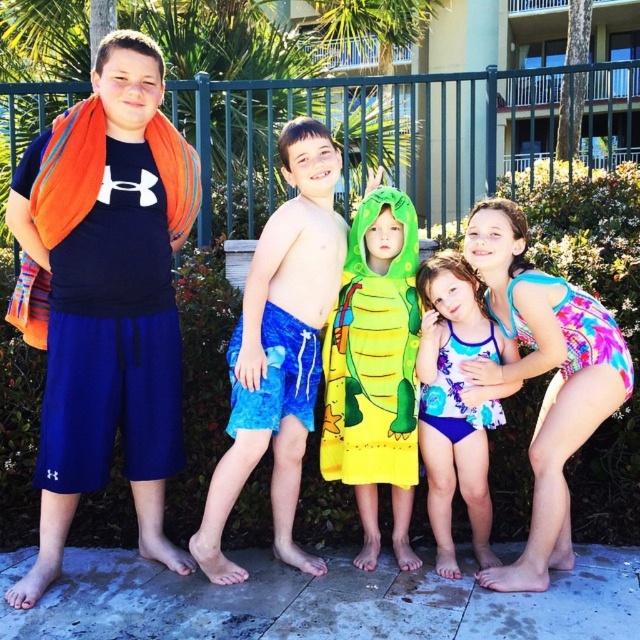
Question: Among these objects, which one is farthest from the camera?

Choices:
 (A) yellow fabric towel at center
 (B) blue textured shorts at center
 (C) multicolored swimsuit at right
 (D) blue printed swimsuit at center

Answer: (A)

Question: Is orange towel at left above multicolored swimsuit at right?

Choices:
 (A) no
 (B) yes

Answer: (B)

Question: Can you confirm if orange towel at left is positioned to the left of yellow fabric towel at center?

Choices:
 (A) yes
 (B) no

Answer: (A)

Question: Which of these objects is positioned farthest from the blue textured shorts at center?

Choices:
 (A) printed fabric swimsuit at center
 (B) multicolored swimsuit at right
 (C) blue printed swimsuit at center

Answer: (B)

Question: Which of the following is the closest to the observer?

Choices:
 (A) blue printed swimsuit at center
 (B) yellow fabric towel at center
 (C) multicolored swimsuit at right
 (D) printed fabric swimsuit at center

Answer: (C)

Question: Can you confirm if blue textured shorts at center is positioned below multicolored swimsuit at right?

Choices:
 (A) no
 (B) yes

Answer: (A)